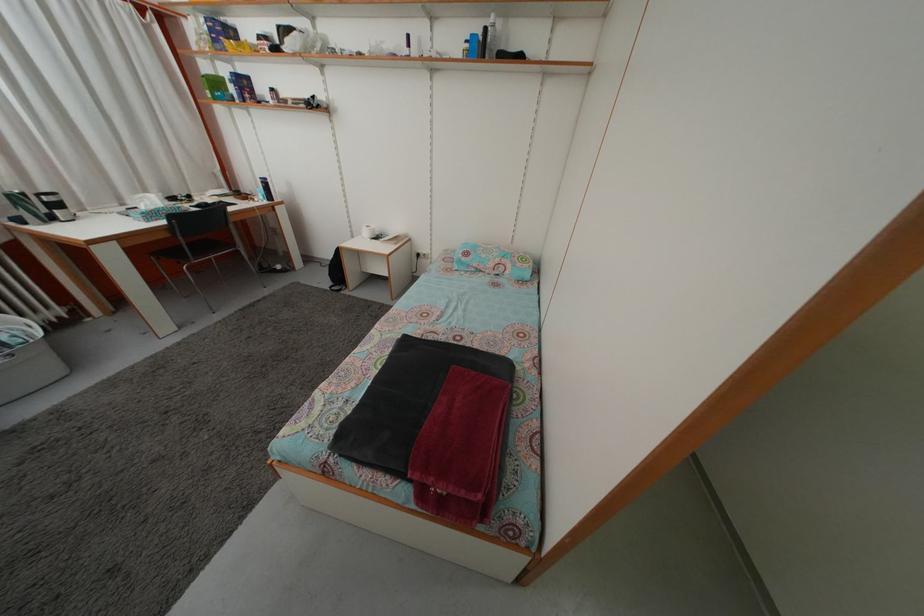
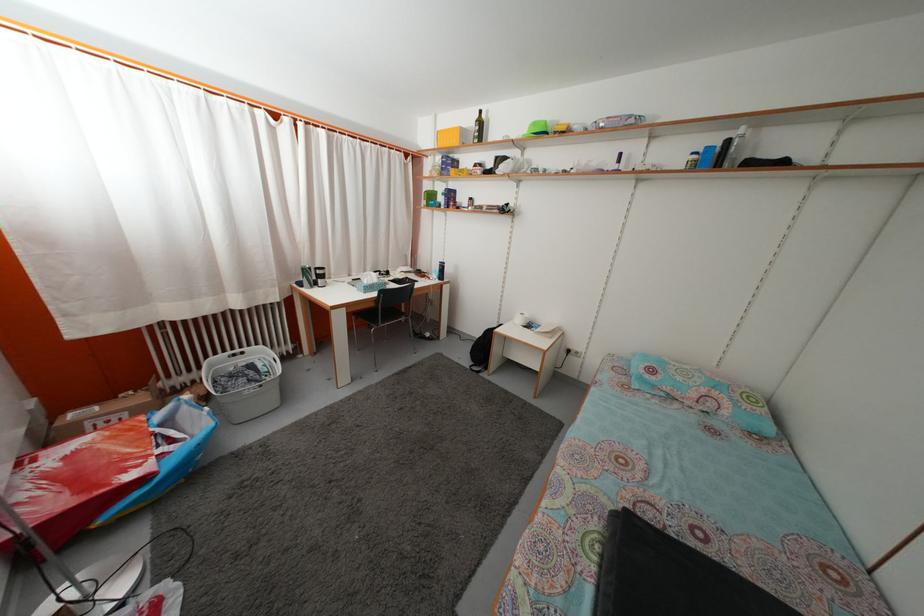
Find the pixel in the second image that matches (x=30, y=201) in the first image.

(315, 276)